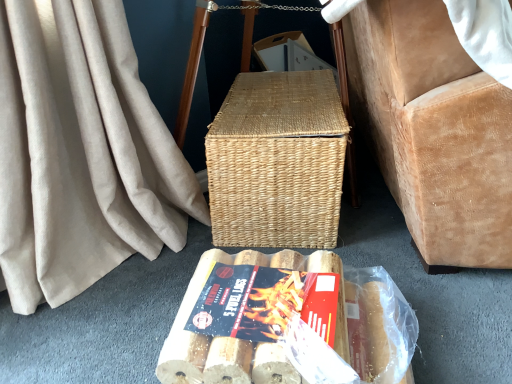
Where is `vacant point above wooden logs at lower center (from a real-world perspective)`? This screenshot has width=512, height=384. vacant point above wooden logs at lower center (from a real-world perspective) is located at coordinates (255, 302).